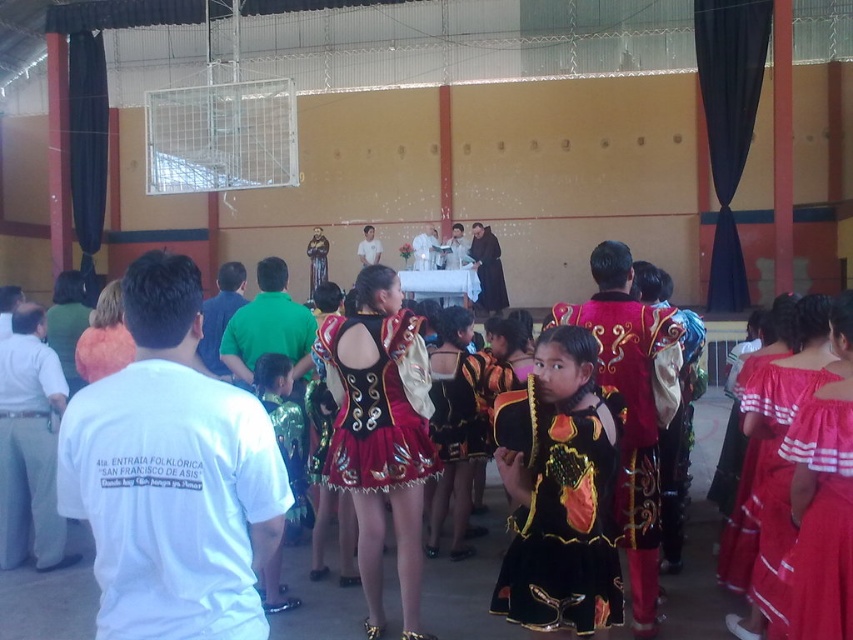
Question: Which point is farther to the camera?

Choices:
 (A) (732, 413)
 (B) (534, 529)
 (C) (407, 480)
 (D) (280, 445)

Answer: (A)

Question: Which object appears farthest from the camera in this image?

Choices:
 (A) shiny gold fabric dress at center
 (B) shiny metallic skirt at center
 (C) red cotton dress at right

Answer: (B)

Question: Is black velvet dress at center to the left of shiny gold fabric dress at center from the viewer's perspective?

Choices:
 (A) yes
 (B) no

Answer: (B)

Question: Based on their relative distances, which object is nearer to the shiny metallic skirt at center?

Choices:
 (A) red cotton dress at right
 (B) black velvet dress at center

Answer: (B)

Question: Where is red cotton dress at right located in relation to shiny metallic skirt at center in the image?

Choices:
 (A) right
 (B) left

Answer: (A)

Question: Is red cotton dress at right to the right of shiny metallic skirt at center from the viewer's perspective?

Choices:
 (A) no
 (B) yes

Answer: (B)